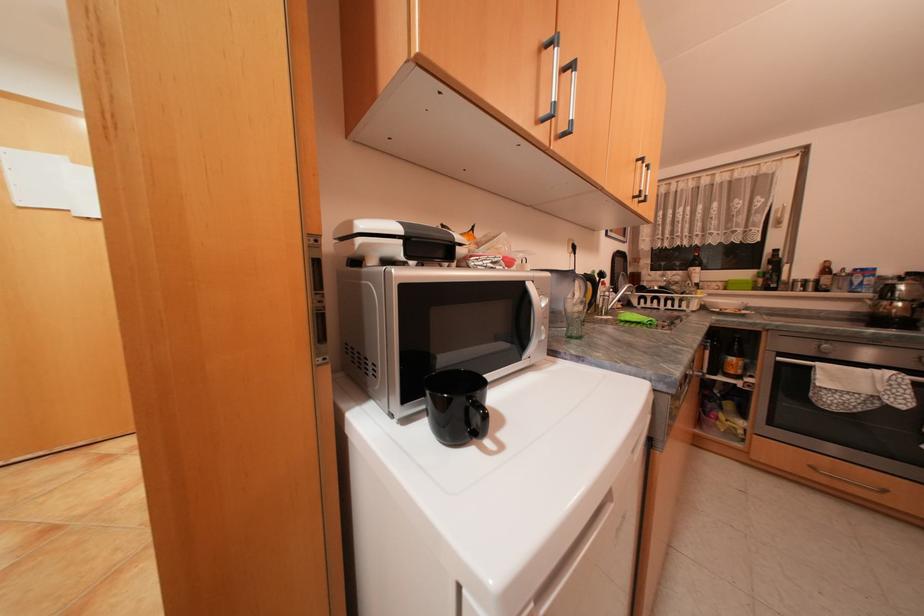
Where is `faucet handle`? faucet handle is located at coordinates (604, 302).